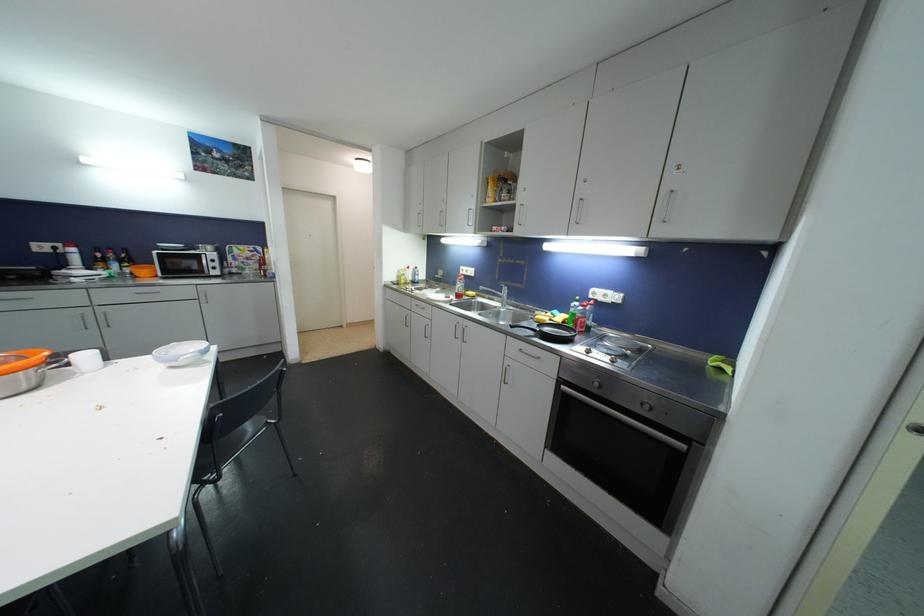
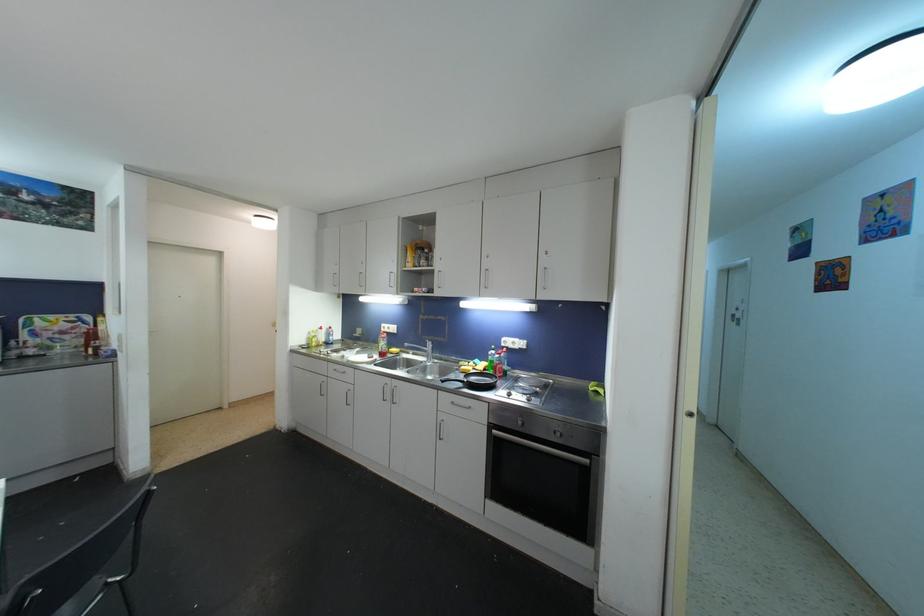
Question: The camera is either moving clockwise (left) or counter-clockwise (right) around the object. The first image is from the beginning of the video and the second image is from the end. Is the camera moving left or right when shooting the video?

Choices:
 (A) Left
 (B) Right

Answer: (A)